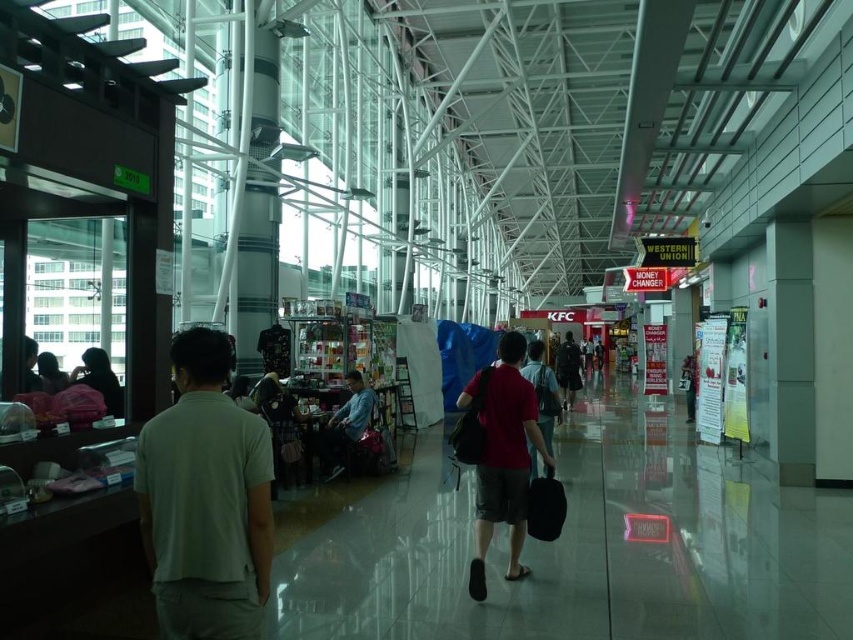
Which is below, light green cotton polo shirt at left or denim jacket at center?

denim jacket at center

From the picture: Does light green cotton polo shirt at left have a larger size compared to denim jacket at center?

Actually, light green cotton polo shirt at left might be smaller than denim jacket at center.

Based on the photo, who is more distant from viewer, (x=177, y=483) or (x=358, y=401)?

The point (x=358, y=401) is more distant.

Where is `light green cotton polo shirt at left`? This screenshot has height=640, width=853. light green cotton polo shirt at left is located at coordinates (206, 500).

Is denim jacket at center to the right of dark red shirt at center from the viewer's perspective?

No, denim jacket at center is not to the right of dark red shirt at center.

Is denim jacket at center shorter than dark red shirt at center?

Indeed, denim jacket at center has a lesser height compared to dark red shirt at center.

Where is `denim jacket at center`? denim jacket at center is located at coordinates (345, 426).

Does matte red shirt at center have a greater width compared to dark red shirt at center?

No.

Which is more to the left, matte red shirt at center or dark red shirt at center?

From the viewer's perspective, matte red shirt at center appears more on the left side.

I want to click on matte red shirt at center, so coord(498,452).